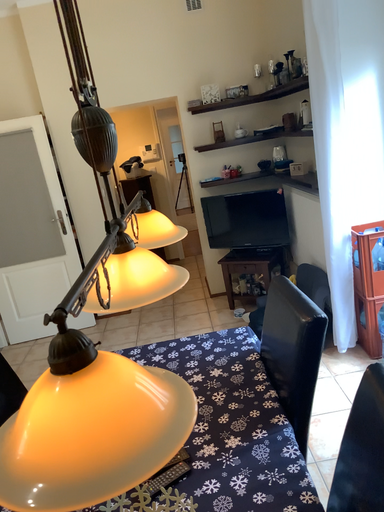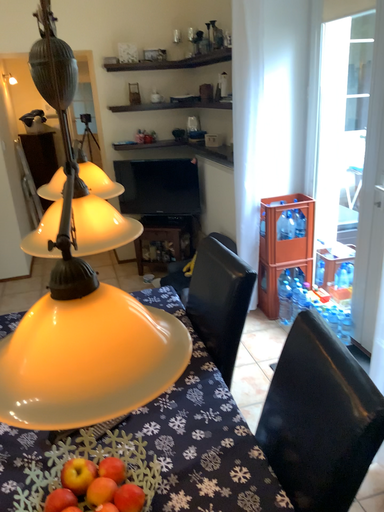
Question: How did the camera likely rotate when shooting the video?

Choices:
 (A) rotated left
 (B) rotated right

Answer: (B)